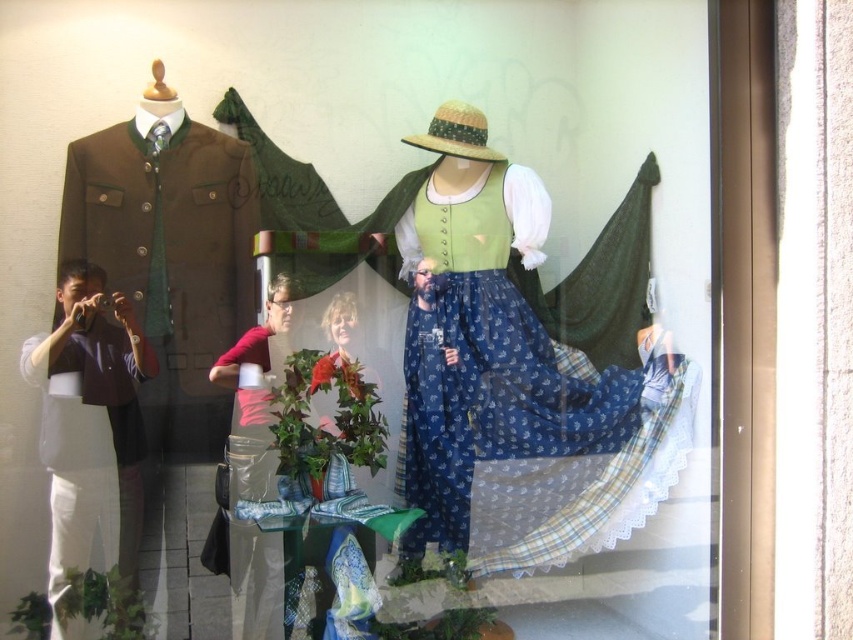
Measure the distance from matte black jacket at left to pink fabric at center.

The distance of matte black jacket at left from pink fabric at center is 11.30 inches.

Is matte black jacket at left behind pink fabric at center?

No, matte black jacket at left is closer to the viewer.

Is point (122, 525) farther from viewer compared to point (277, 289)?

No.

At what (x,y) coordinates should I click in order to perform the action: click on matte black jacket at left. Please return your answer as a coordinate pair (x, y). Image resolution: width=853 pixels, height=640 pixels. Looking at the image, I should click on (90, 424).

Is blue printed skirt at center taller than smooth skin portrait at center?

Yes.

Which is in front, point (585, 513) or point (379, 417)?

Point (379, 417) is more forward.

Find the location of a particular element. The width and height of the screenshot is (853, 640). blue printed skirt at center is located at coordinates (503, 387).

Consider the image. Can you confirm if smooth skin portrait at center is positioned below pink fabric at center?

Actually, smooth skin portrait at center is above pink fabric at center.

Between point (373, 403) and point (223, 524), which one is positioned in front?

Point (223, 524) is in front.

Find the location of a particular element. smooth skin portrait at center is located at coordinates (352, 388).